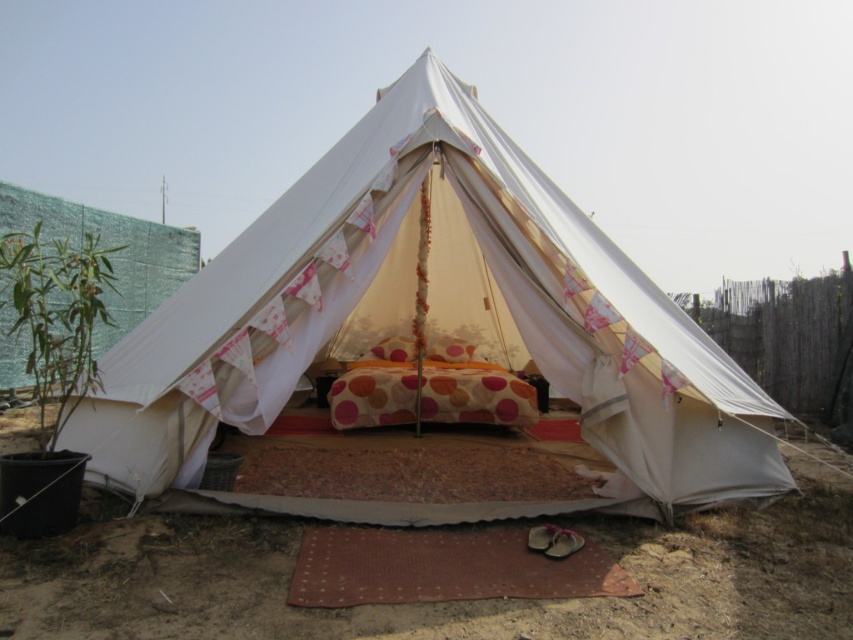
You are planning to set up a picnic blanket in the area shown in the image. The picnic blanket is 2 meters wide. Based on the scene, will the picnic blanket fit between the white canvas tent at center and the brown sandy dirt at lower center?

The white canvas tent at center is wider than the brown sandy dirt at lower center. Therefore, the picnic blanket that is 2 meters wide may not fit between them if the space between the two objects is narrower than 2 meters. However, without specific distance information, it is impossible to determine for sure.

You are standing at the origin point of the coordinate system, which is the bottom left corner of the image. You want to place a new decorative mat exactly 0.2 units to the right and 0.1 units above the white canvas tent at center. What are the coordinates of the new mat?

The white canvas tent at center is located at coordinates point (432, 323). Adding 0.2 units to the x coordinate and 0.1 units to the y coordinate gives the new coordinates as (518, 451).